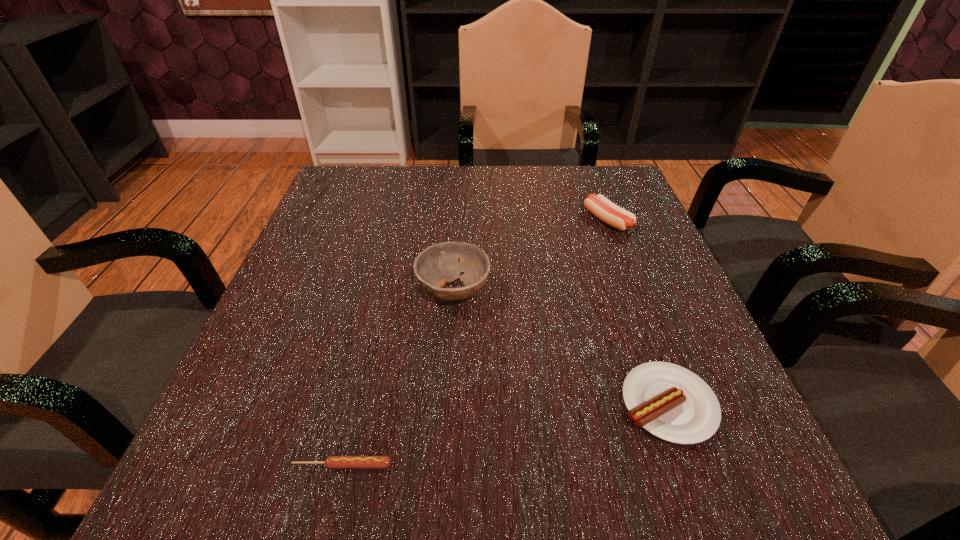
At what (x,y) coordinates should I click in order to perform the action: click on free spot between the shortest object and the second shortest sausage. Please return your answer as a coordinate pair (x, y). The height and width of the screenshot is (540, 960). Looking at the image, I should click on (505, 435).

Image resolution: width=960 pixels, height=540 pixels. What are the coordinates of `free spot between the farthest object and the shortest sausage` in the screenshot? It's located at (475, 343).

The width and height of the screenshot is (960, 540). What are the coordinates of `free spot between the shortest object and the bowl` in the screenshot? It's located at (398, 378).

Find the location of `the second closest object to the second farthest object`. the second closest object to the second farthest object is located at coordinates (601, 207).

Select which object is the closest to the second shortest sausage. Please provide its 2D coordinates. Your answer should be formatted as a tuple, i.e. [(x, y)], where the tuple contains the x and y coordinates of a point satisfying the conditions above.

[(442, 263)]

Identify the location of sausage that is the second closest to the farthest sausage. Image resolution: width=960 pixels, height=540 pixels. (331, 462).

Where is `sausage that is the second closest to the third farthest object`? The width and height of the screenshot is (960, 540). sausage that is the second closest to the third farthest object is located at coordinates (601, 207).

At what (x,y) coordinates should I click in order to perform the action: click on vacant area that satisfies the following two spatial constraints: 1. on the front side of the second shortest sausage; 2. on the right side of the third nearest object. Please return your answer as a coordinate pair (x, y). This screenshot has width=960, height=540. Looking at the image, I should click on (446, 404).